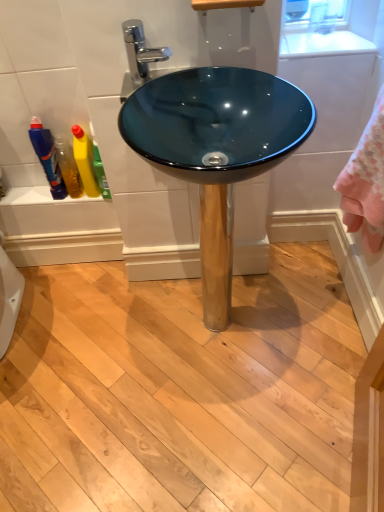
Question: Can you confirm if translucent plastic bottle at left is bigger than translucent plastic bottles at left?

Choices:
 (A) no
 (B) yes

Answer: (B)

Question: Considering the relative sizes of translucent plastic bottle at left and translucent plastic bottles at left in the image provided, is translucent plastic bottle at left taller than translucent plastic bottles at left?

Choices:
 (A) no
 (B) yes

Answer: (B)

Question: Would you say translucent plastic bottles at left is part of translucent plastic bottle at left's contents?

Choices:
 (A) no
 (B) yes

Answer: (A)

Question: From a real-world perspective, is translucent plastic bottle at left on top of translucent plastic bottles at left?

Choices:
 (A) no
 (B) yes

Answer: (B)

Question: Is translucent plastic bottle at left located outside translucent plastic bottles at left?

Choices:
 (A) yes
 (B) no

Answer: (A)

Question: Can you confirm if translucent plastic bottle at left is smaller than translucent plastic bottles at left?

Choices:
 (A) yes
 (B) no

Answer: (B)

Question: Is translucent plastic bottles at left wider than teal glass bowl at center?

Choices:
 (A) yes
 (B) no

Answer: (B)

Question: Considering the relative positions of translucent plastic bottles at left and teal glass bowl at center in the image provided, is translucent plastic bottles at left to the left of teal glass bowl at center from the viewer's perspective?

Choices:
 (A) yes
 (B) no

Answer: (A)

Question: Does translucent plastic bottles at left appear on the right side of teal glass bowl at center?

Choices:
 (A) no
 (B) yes

Answer: (A)

Question: Is translucent plastic bottles at left not within teal glass bowl at center?

Choices:
 (A) no
 (B) yes

Answer: (B)

Question: Is teal glass bowl at center completely or partially inside translucent plastic bottles at left?

Choices:
 (A) yes
 (B) no

Answer: (B)

Question: From a real-world perspective, is translucent plastic bottles at left positioned over teal glass bowl at center based on gravity?

Choices:
 (A) yes
 (B) no

Answer: (A)

Question: From the image's perspective, is teal glass bowl at center below chrome metallic faucet at upper center?

Choices:
 (A) yes
 (B) no

Answer: (A)